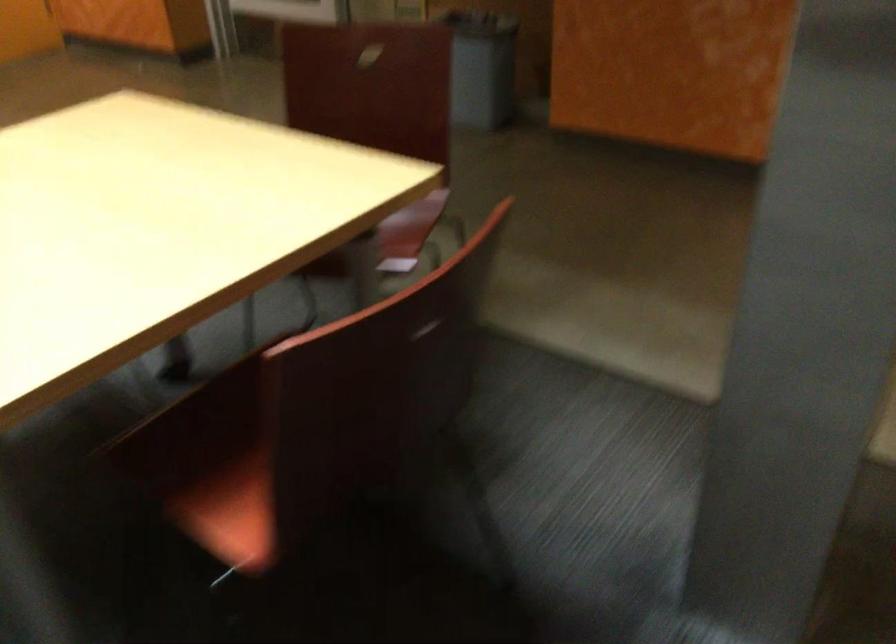
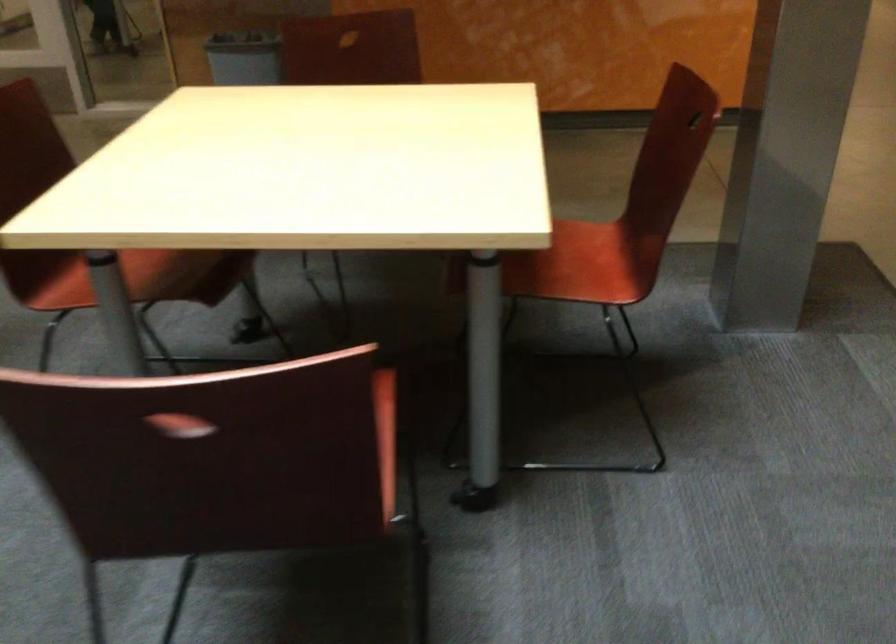
Find the pixel in the second image that matches (476,312) in the first image.

(694, 120)